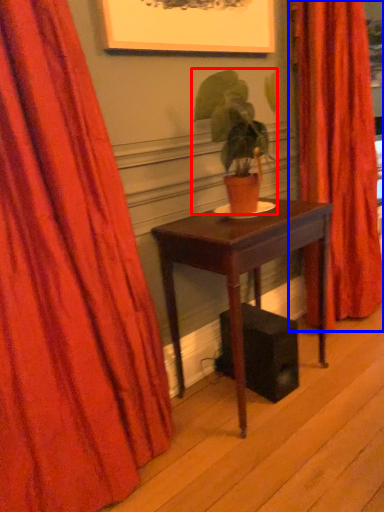
Question: Among these objects, which one is farthest to the camera, houseplant (highlighted by a red box) or curtain (highlighted by a blue box)?

Choices:
 (A) houseplant
 (B) curtain

Answer: (B)